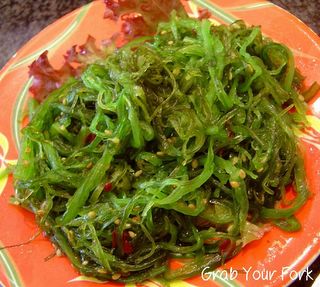
You are a GUI agent. You are given a task and a screenshot of the screen. Output one action in this format:
    pyautogui.click(x=<x>, y=<y>)
    Task: Click on the plate
    The image size is (320, 287).
    Given the screenshot: What is the action you would take?
    pyautogui.click(x=259, y=256)